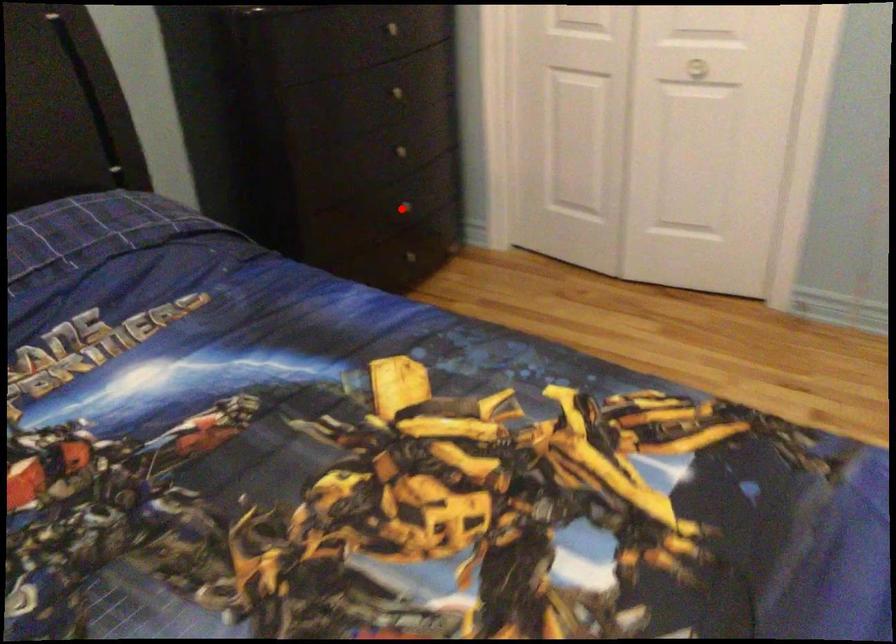
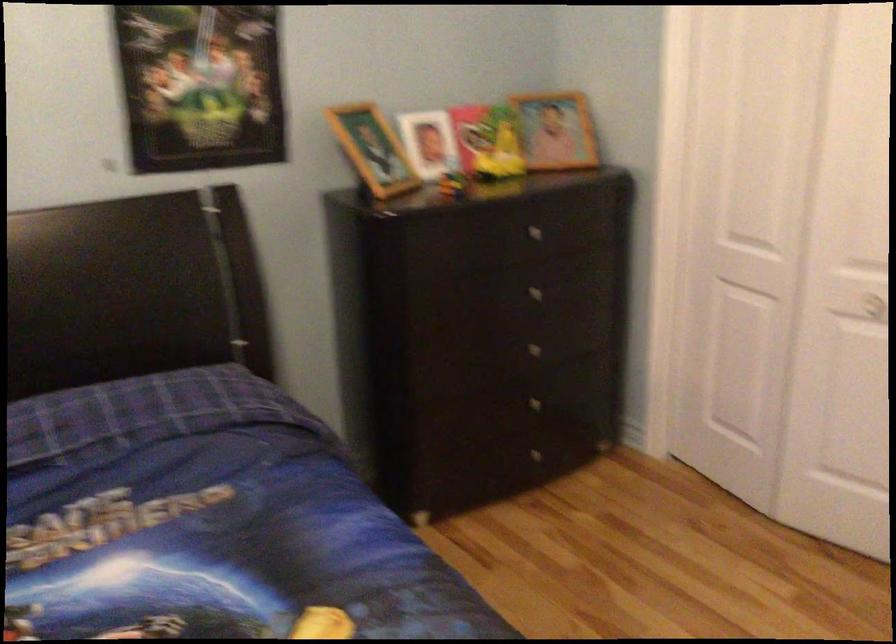
Find the pixel in the second image that matches the highlighted location in the first image.

(528, 406)